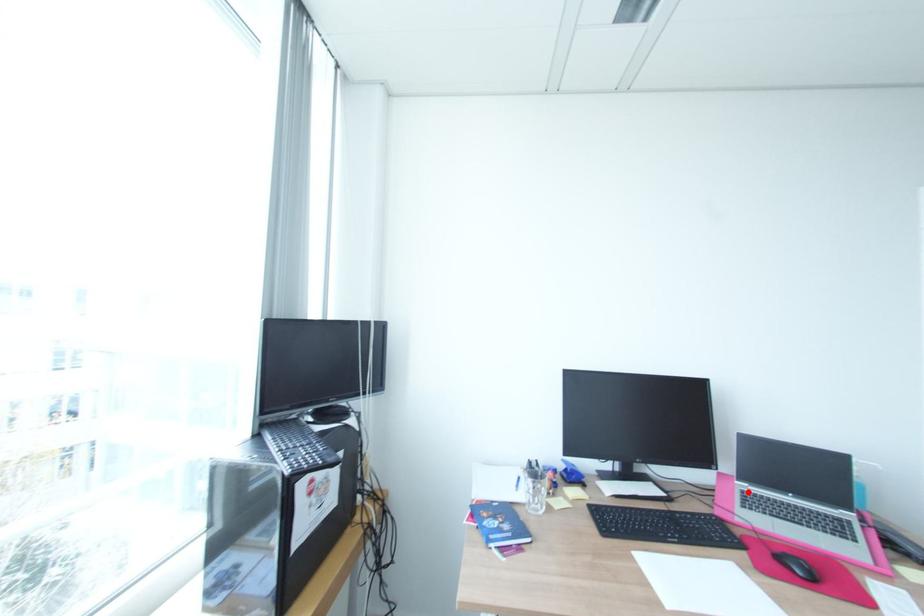
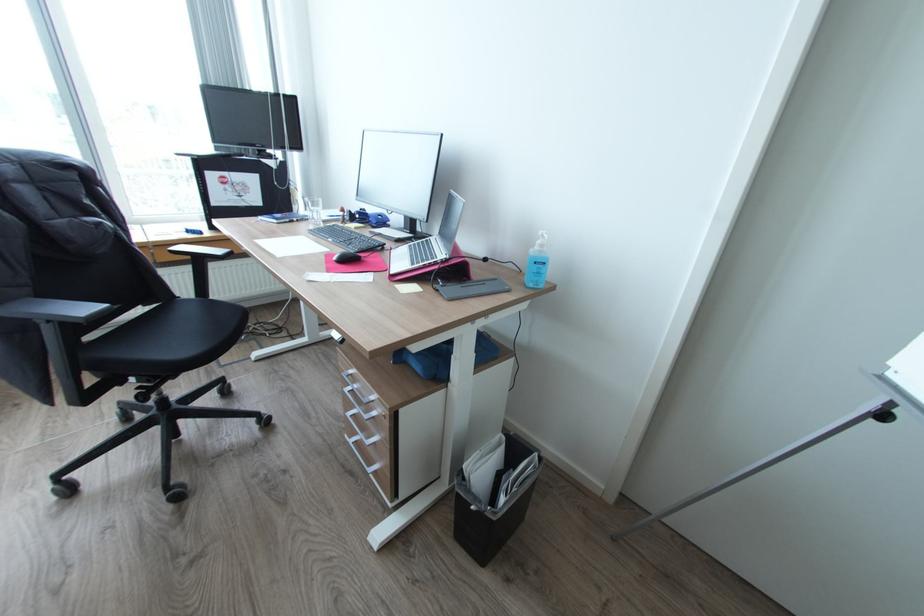
Locate, in the second image, the point that corresponds to the highlighted location in the first image.

(432, 238)